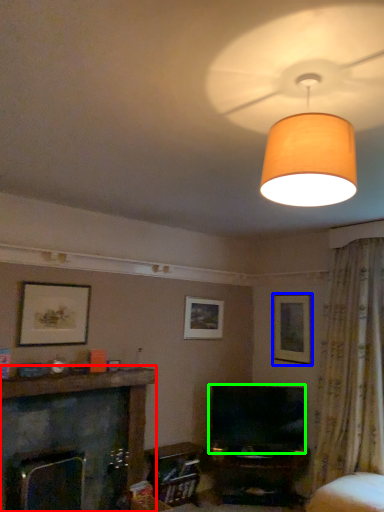
Question: Estimate the real-world distances between objects in this image. Which object is farther from fireplace (highlighted by a red box), picture frame (highlighted by a blue box) or television (highlighted by a green box)?

Choices:
 (A) picture frame
 (B) television

Answer: (A)